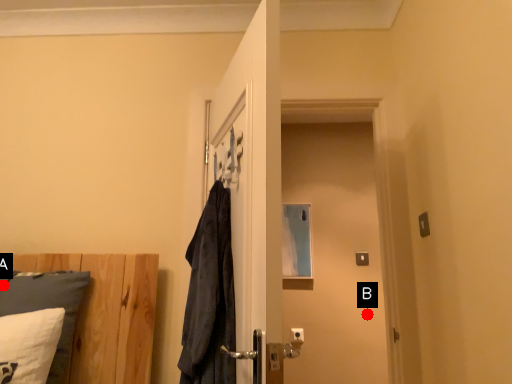
Question: Two points are circled on the image, labeled by A and B beside each circle. Which point appears farthest from the camera in this image?

Choices:
 (A) A is further
 (B) B is further

Answer: (B)